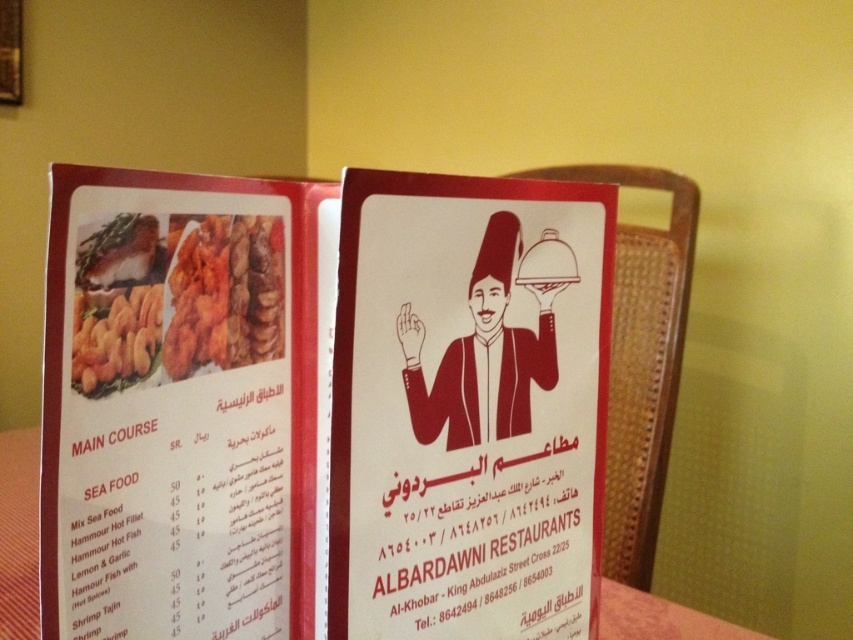
Who is taller, matte paper menu at center or golden crispy fish at upper left?

Standing taller between the two is matte paper menu at center.

Image resolution: width=853 pixels, height=640 pixels. What are the coordinates of `matte paper menu at center` in the screenshot? It's located at (189, 412).

Looking at this image, who is more forward, (241, 515) or (122, 257)?

Point (122, 257)

What are the coordinates of `matte paper menu at center` in the screenshot? It's located at (189, 412).

Can you confirm if matte red menu at center is positioned to the right of golden crispy fish at upper left?

Correct, you'll find matte red menu at center to the right of golden crispy fish at upper left.

Does matte red menu at center appear on the left side of golden crispy fish at upper left?

In fact, matte red menu at center is to the right of golden crispy fish at upper left.

Does point (355, 170) come behind point (106, 278)?

No, it is not.

Locate an element on the screen. This screenshot has width=853, height=640. matte red menu at center is located at coordinates (468, 406).

Is matte paper menu at center above brown paper-like material waiter at center?

No.

Which is in front, point (39, 554) or point (405, 368)?

Point (39, 554) is in front.

Between point (321, 634) and point (473, 428), which one is positioned in front?

Point (473, 428)

This screenshot has height=640, width=853. Identify the location of matte paper menu at center. (189, 412).